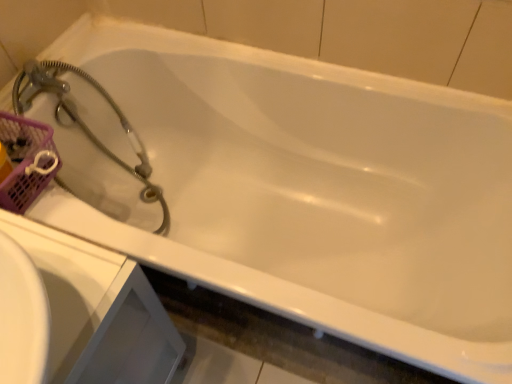
Question: Can you confirm if satin silver hose at upper left is thinner than pink mesh basket at upper left?

Choices:
 (A) no
 (B) yes

Answer: (A)

Question: Is there a large distance between satin silver hose at upper left and pink mesh basket at upper left?

Choices:
 (A) no
 (B) yes

Answer: (A)

Question: Could you tell me if satin silver hose at upper left is turned towards pink mesh basket at upper left?

Choices:
 (A) yes
 (B) no

Answer: (B)

Question: Is pink mesh basket at upper left surrounded by satin silver hose at upper left?

Choices:
 (A) yes
 (B) no

Answer: (B)

Question: Does satin silver hose at upper left have a larger size compared to pink mesh basket at upper left?

Choices:
 (A) no
 (B) yes

Answer: (B)

Question: Considering the positions of point (60, 99) and point (96, 334), is point (60, 99) closer or farther from the camera than point (96, 334)?

Choices:
 (A) farther
 (B) closer

Answer: (A)

Question: Looking at their shapes, would you say satin silver hose at upper left is wider or thinner than white glossy sink at lower left?

Choices:
 (A) thin
 (B) wide

Answer: (B)

Question: From a real-world perspective, is satin silver hose at upper left positioned above or below white glossy sink at lower left?

Choices:
 (A) below
 (B) above

Answer: (B)

Question: From the image's perspective, is satin silver hose at upper left above or below white glossy sink at lower left?

Choices:
 (A) above
 (B) below

Answer: (A)

Question: Is pink mesh basket at upper left wider or thinner than satin silver hose at upper left?

Choices:
 (A) thin
 (B) wide

Answer: (A)

Question: From the image's perspective, relative to satin silver hose at upper left, is pink mesh basket at upper left above or below?

Choices:
 (A) above
 (B) below

Answer: (B)

Question: Based on their positions, is pink mesh basket at upper left located to the left or right of satin silver hose at upper left?

Choices:
 (A) left
 (B) right

Answer: (A)

Question: Is pink mesh basket at upper left taller or shorter than satin silver hose at upper left?

Choices:
 (A) short
 (B) tall

Answer: (A)

Question: From a real-world perspective, relative to satin silver hose at upper left, is white glossy sink at lower left vertically above or below?

Choices:
 (A) below
 (B) above

Answer: (A)

Question: In terms of width, does white glossy sink at lower left look wider or thinner when compared to satin silver hose at upper left?

Choices:
 (A) wide
 (B) thin

Answer: (B)